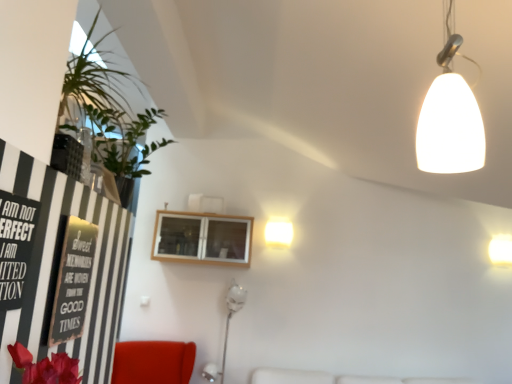
Question: Considering the relative sizes of white glossy lamp at lower center and green leafy plant at upper left in the image provided, is white glossy lamp at lower center smaller than green leafy plant at upper left?

Choices:
 (A) yes
 (B) no

Answer: (B)

Question: Does white glossy lamp at lower center have a greater height compared to green leafy plant at upper left?

Choices:
 (A) no
 (B) yes

Answer: (B)

Question: Does white glossy lamp at lower center lie in front of green leafy plant at upper left?

Choices:
 (A) yes
 (B) no

Answer: (B)

Question: Can green leafy plant at upper left be found inside white glossy lamp at lower center?

Choices:
 (A) yes
 (B) no

Answer: (B)

Question: Are white glossy lamp at lower center and green leafy plant at upper left far apart?

Choices:
 (A) yes
 (B) no

Answer: (A)

Question: Is wooden cabinet at upper center wider or thinner than green leafy plant at upper left?

Choices:
 (A) thin
 (B) wide

Answer: (A)

Question: Is wooden cabinet at upper center inside or outside of green leafy plant at upper left?

Choices:
 (A) outside
 (B) inside

Answer: (A)

Question: From the image's perspective, is wooden cabinet at upper center positioned above or below green leafy plant at upper left?

Choices:
 (A) below
 (B) above

Answer: (A)

Question: In terms of size, does wooden cabinet at upper center appear bigger or smaller than green leafy plant at upper left?

Choices:
 (A) small
 (B) big

Answer: (B)

Question: In terms of width, does white glossy lamp at lower center look wider or thinner when compared to green leafy plant at upper left?

Choices:
 (A) thin
 (B) wide

Answer: (A)

Question: From the image's perspective, relative to green leafy plant at upper left, is white glossy lamp at lower center above or below?

Choices:
 (A) below
 (B) above

Answer: (A)

Question: Considering the positions of point (215, 364) and point (75, 67), is point (215, 364) closer or farther from the camera than point (75, 67)?

Choices:
 (A) farther
 (B) closer

Answer: (A)

Question: Is white glossy lamp at lower center in front of or behind green leafy plant at upper left in the image?

Choices:
 (A) front
 (B) behind

Answer: (B)

Question: Visually, is white glossy wall sconce at upper right, marked as the 2th lamp in a back-to-front arrangement, positioned to the left or to the right of white glossy wall lamp at upper center, placed as the third lamp when sorted from right to left?

Choices:
 (A) right
 (B) left

Answer: (A)

Question: From a real-world perspective, is white glossy wall sconce at upper right, the 1th lamp from the bottom, above or below white glossy wall lamp at upper center, placed as the third lamp when sorted from right to left?

Choices:
 (A) above
 (B) below

Answer: (B)